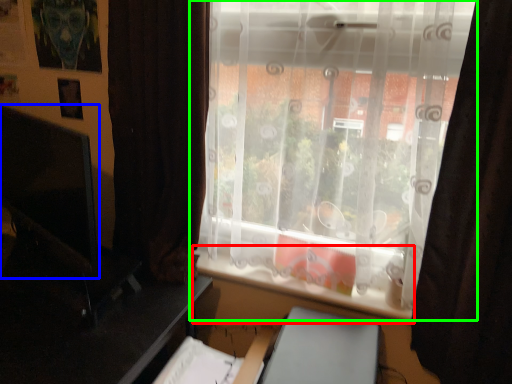
Question: Based on their relative distances, which object is farther from window sill (highlighted by a red box)? Choose from computer monitor (highlighted by a blue box) and window (highlighted by a green box).

Choices:
 (A) computer monitor
 (B) window

Answer: (A)